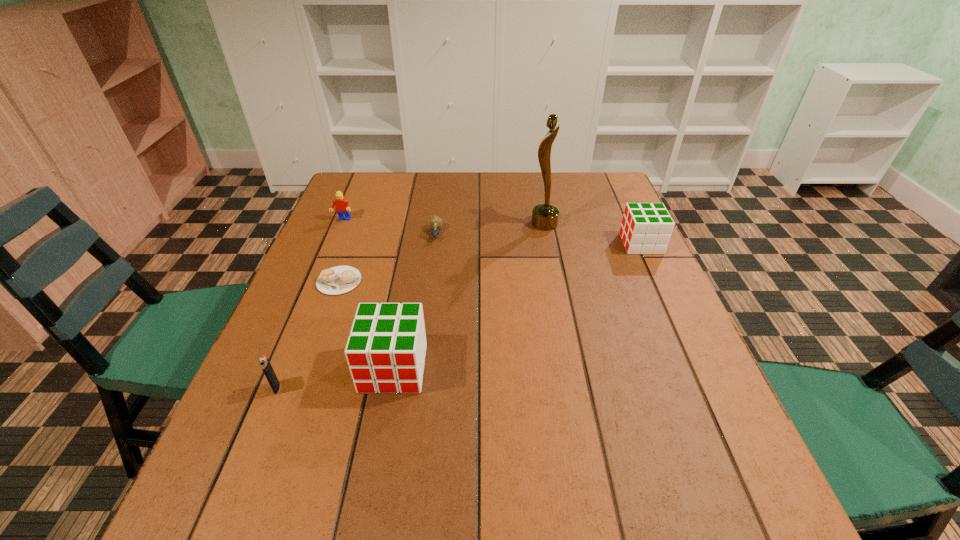
The height and width of the screenshot is (540, 960). I want to click on free space for an extra cube to achieve even spacing, so click(x=536, y=296).